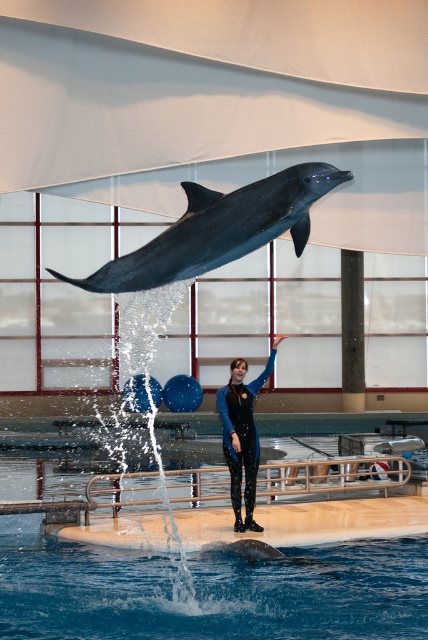
Does blue liquid water at center have a smaller size compared to blue rubber wetsuit at center?

No, blue liquid water at center is not smaller than blue rubber wetsuit at center.

Which is behind, point (385, 540) or point (246, 440)?

Positioned behind is point (246, 440).

Identify the location of blue liquid water at center. (210, 592).

Is shiny dark blue dolphin at center bigger than blue rubber wetsuit at center?

Actually, shiny dark blue dolphin at center might be smaller than blue rubber wetsuit at center.

Is shiny dark blue dolphin at center closer to the viewer compared to blue rubber wetsuit at center?

Yes, shiny dark blue dolphin at center is in front of blue rubber wetsuit at center.

Which is behind, point (106, 280) or point (240, 387)?

The point (240, 387) is behind.

Identify the location of shiny dark blue dolphin at center. (219, 228).

Which is more to the left, blue liquid water at center or shiny dark blue dolphin at center?

blue liquid water at center

Is blue liquid water at center shorter than shiny dark blue dolphin at center?

Indeed, blue liquid water at center has a lesser height compared to shiny dark blue dolphin at center.

Which is in front, point (103, 598) or point (98, 285)?

Positioned in front is point (98, 285).

Where is `blue liquid water at center`? The image size is (428, 640). blue liquid water at center is located at coordinates (210, 592).